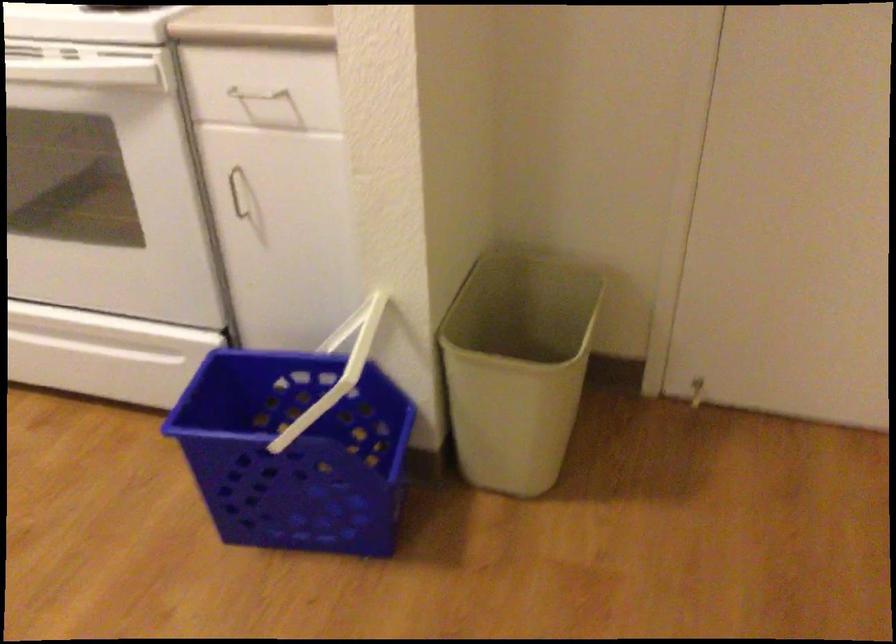
Where would you lift the white basket handle? Please return your answer as a coordinate pair (x, y).

(346, 328)